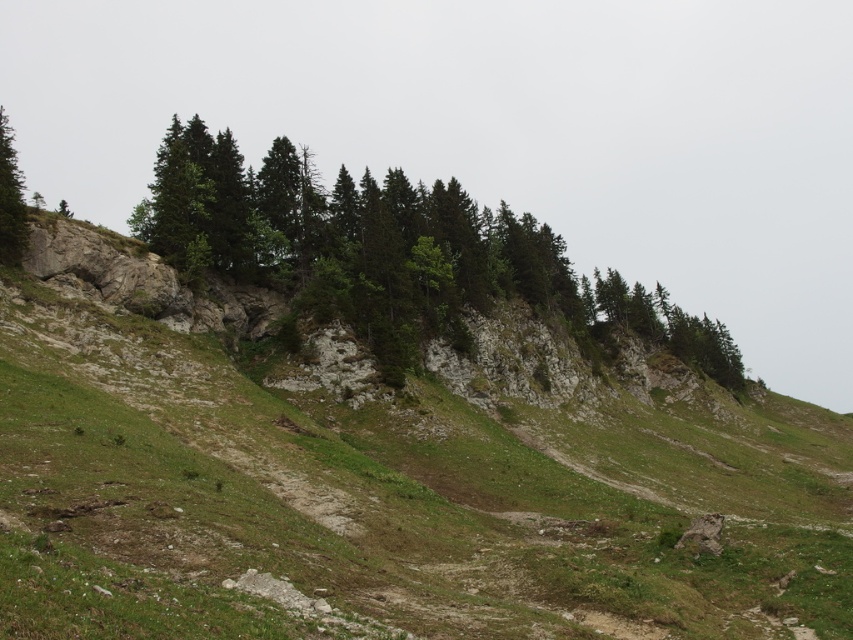
You are standing at the base of the hill and want to take a photo of the green textured trees at center. If your camera has a maximum focus range of 70 meters, will you be able to capture the trees clearly?

The green textured trees at center and camera are 76.00 meters apart, so the camera cannot focus clearly on them since the distance exceeds the maximum focus range of 70 meters.

You are a hiker trying to navigate through the hillside. You see the green textured trees at center and the green matte tree at left. Which tree is closer to you?

The green textured trees at center are closer to you because the green matte tree at left is behind them.

You are standing at the bottom of the slope and want to reach the green textured trees at center. Which direction should you go to first approach the green grassy hillside at center before reaching the trees?

You should head towards the green grassy hillside at center first since it is closer to you than the green textured trees at center, so approaching it first will naturally lead you toward the trees.